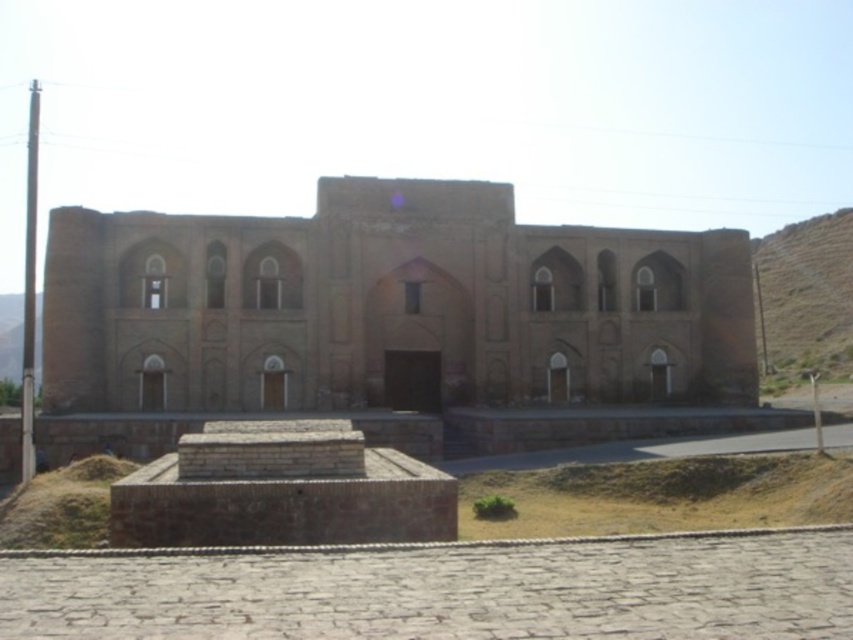
Between brown rocky hill at right and brown grass at lower left, which one is positioned higher?

brown rocky hill at right

In the scene shown: Which is more to the left, brown rocky hill at right or brown grass at lower left?

Positioned to the left is brown grass at lower left.

Who is more distant from viewer, (795,310) or (61,481)?

Positioned behind is point (795,310).

You are a GUI agent. You are given a task and a screenshot of the screen. Output one action in this format:
    pyautogui.click(x=<x>, y=<y>)
    Task: Click on the brown rocky hill at right
    This screenshot has width=853, height=640.
    Given the screenshot: What is the action you would take?
    pyautogui.click(x=805, y=298)